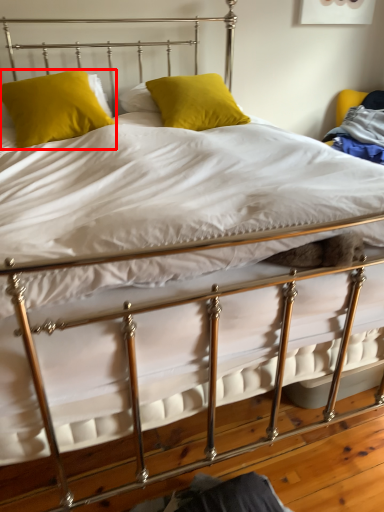
Question: From the image's perspective, where is pillow (annotated by the red box) located relative to pillow?

Choices:
 (A) below
 (B) above

Answer: (A)